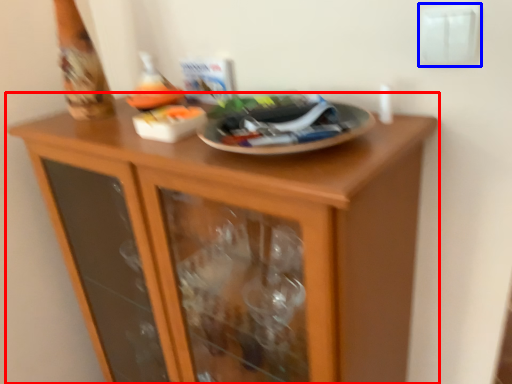
Question: Among these objects, which one is nearest to the camera, cupboard (highlighted by a red box) or electric outlet (highlighted by a blue box)?

Choices:
 (A) cupboard
 (B) electric outlet

Answer: (A)